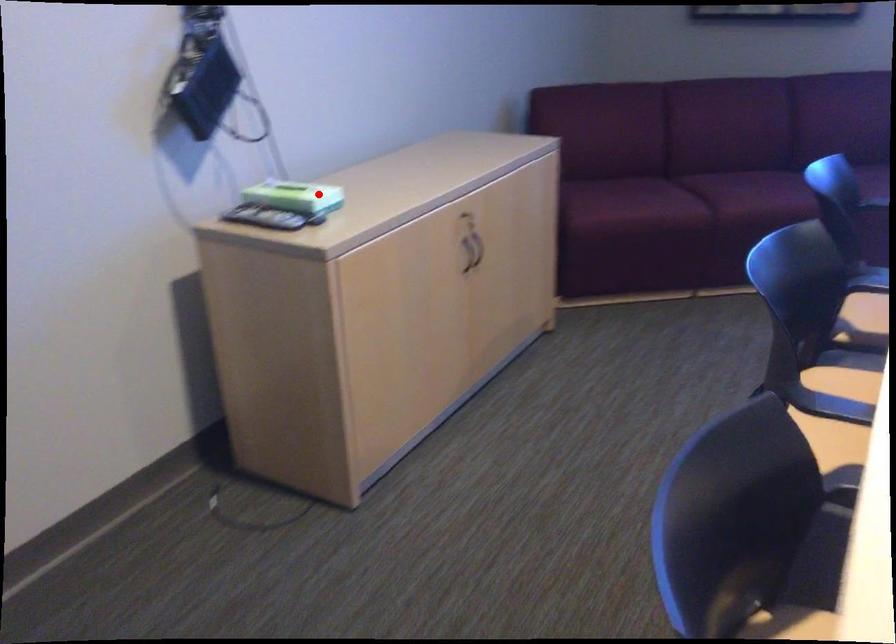
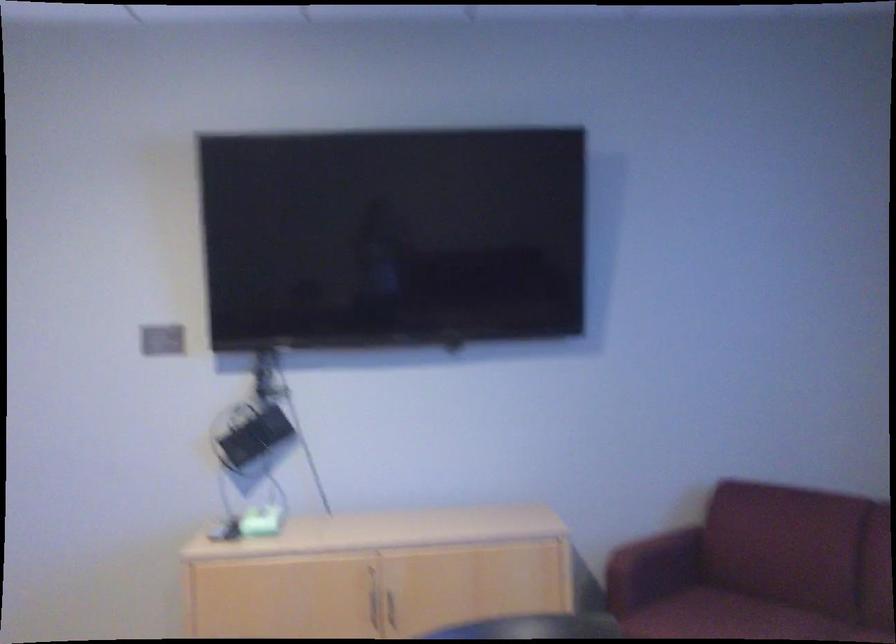
Question: I am providing you with two images of the same scene from different viewpoints. Image1 has a red point marked. In image2, the corresponding 3D location appears at what relative position? Reply with the corresponding letter.

Choices:
 (A) Closer
 (B) Farther

Answer: (B)